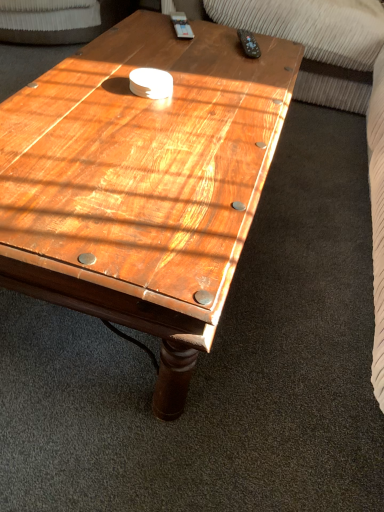
Image resolution: width=384 pixels, height=512 pixels. What are the coordinates of `vacant space to the right of black plastic remote at upper right` in the screenshot? It's located at (274, 56).